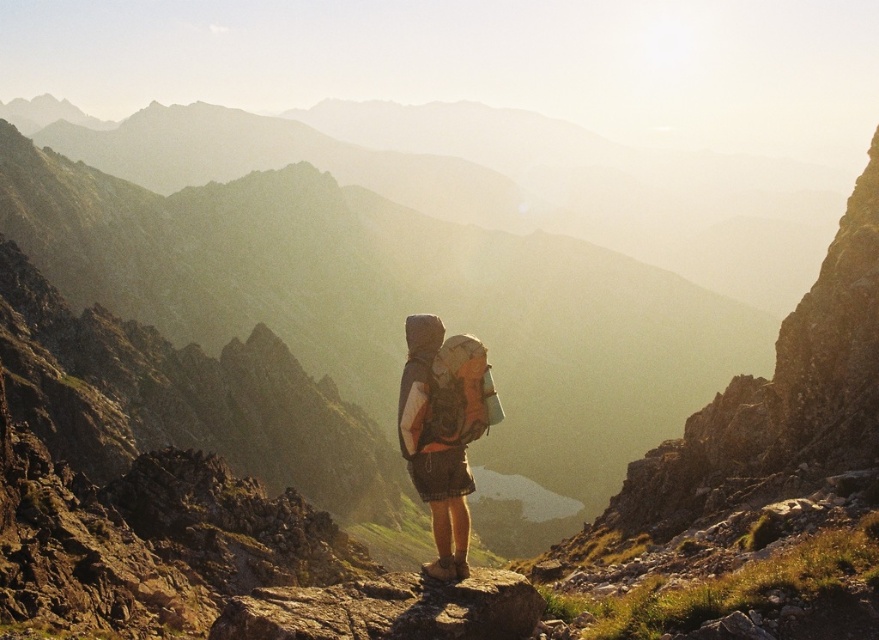
You are a hiker who wants to place your matte gray backpack at center on the ground next to the rusty rock at center. Given that the backpack is 2 feet wide, is there enough space between them to do so?

The rusty rock at center and matte gray backpack at center are 6.83 feet apart, so yes, there is enough space between them to place the matte gray backpack at center next to the rusty rock at center since the distance is greater than the backpack width.

You are a hiker who needs to cross the valley below. You have a matte gray backpack at center and a rusty rock at center nearby. Which object is wider, and can you use the wider one as a stepping stone to cross a small stream?

The rusty rock at center is wider than the matte gray backpack at center. Since the rusty rock at center is wider, it can be used as a stable stepping stone to cross the small stream safely.

You are standing at the point labeled point (222, 621) and want to reach the point labeled point (478, 404). Which direction should you move to get there?

To move from point (222, 621) to point (478, 404), you should move backward since point (222, 621) is in front of point (478, 404).